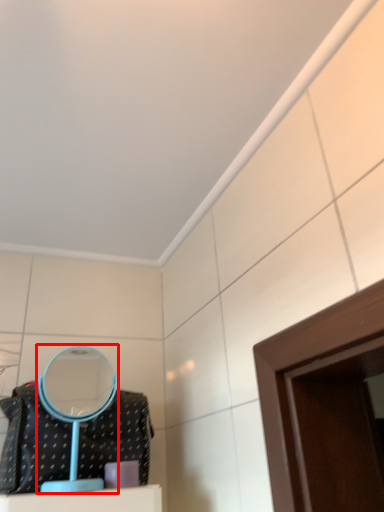
Question: From the image's perspective, considering the relative positions of mirror (annotated by the red box) and clothing in the image provided, where is mirror (annotated by the red box) located with respect to the staircase?

Choices:
 (A) below
 (B) above

Answer: (B)